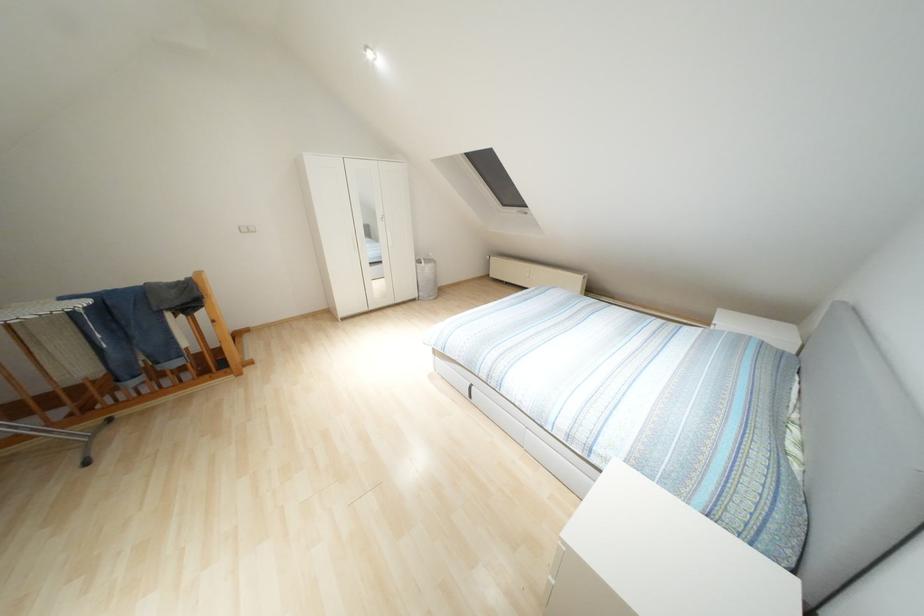
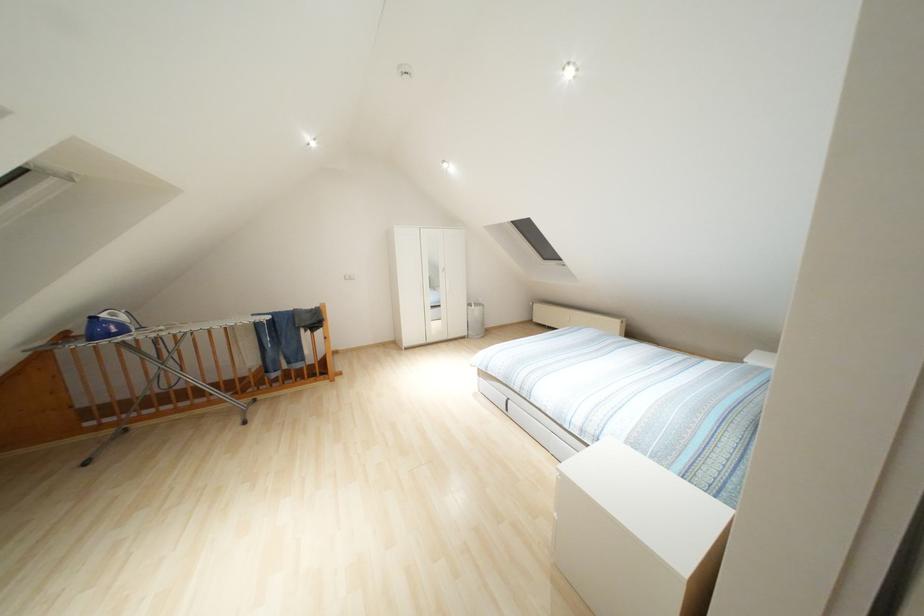
Question: The images are taken continuously from a first-person perspective. In which direction is your viewpoint rotating?

Choices:
 (A) Left
 (B) Right
 (C) Up
 (D) Down

Answer: (A)